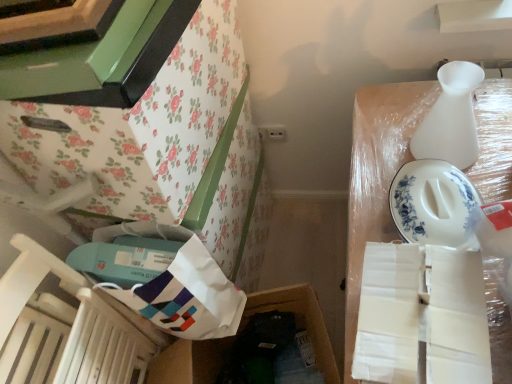
From the picture: Measure the distance between point (x=21, y=290) and camera.

The depth of point (x=21, y=290) is 32.72 inches.

Find the location of a particular element. The height and width of the screenshot is (384, 512). white paper bag at lower left, positioned as the second wrapping paper in front-to-back order is located at coordinates (187, 296).

The height and width of the screenshot is (384, 512). Find the location of `white paper bag at lower left, which is counted as the 1th storage box, starting from the left`. white paper bag at lower left, which is counted as the 1th storage box, starting from the left is located at coordinates (298, 320).

In order to click on white matte vase at upper right in this screenshot , I will do `click(451, 118)`.

Describe the element at coordinates (422, 315) in the screenshot. Image resolution: width=512 pixels, height=384 pixels. I see `white matte wrapping paper at right, the 1th wrapping paper in the right-to-left sequence` at that location.

The image size is (512, 384). I want to click on white cardboard box at upper right, which is counted as the 1th storage box, starting from the right, so click(377, 176).

At what (x,y) coordinates should I click in order to perform the action: click on wrapping paper lying on the left of white paper bag at lower left, the 2th storage box positioned from the right. Please return your answer as a coordinate pair (x, y). Looking at the image, I should click on (187, 296).

Considering the relative sizes of white paper bag at lower left, positioned as the second wrapping paper in front-to-back order, and white paper bag at lower left, the 2th storage box positioned from the right, in the image provided, is white paper bag at lower left, positioned as the second wrapping paper in front-to-back order, taller than white paper bag at lower left, the 2th storage box positioned from the right,?

In fact, white paper bag at lower left, positioned as the second wrapping paper in front-to-back order, may be shorter than white paper bag at lower left, the 2th storage box positioned from the right.

From the image's perspective, is white paper bag at lower left, the first wrapping paper positioned from the left, over white paper bag at lower left, the 2th storage box positioned from the right?

Correct, white paper bag at lower left, the first wrapping paper positioned from the left, appears higher than white paper bag at lower left, the 2th storage box positioned from the right, in the image.

Would you say floral paper-covered cabinet at upper left contains white cardboard box at upper right, which is counted as the 1th storage box, starting from the right?

That's incorrect, white cardboard box at upper right, which is counted as the 1th storage box, starting from the right, is not inside floral paper-covered cabinet at upper left.

Between floral paper-covered cabinet at upper left and white cardboard box at upper right, which is counted as the 1th storage box, starting from the right, which one is positioned in front?

white cardboard box at upper right, which is counted as the 1th storage box, starting from the right.

From a real-world perspective, is floral paper-covered cabinet at upper left positioned over white cardboard box at upper right, which is counted as the 1th storage box, starting from the right, based on gravity?

Correct, in the physical world, floral paper-covered cabinet at upper left is higher than white cardboard box at upper right, which is counted as the 1th storage box, starting from the right.

Can you confirm if floral paper-covered cabinet at upper left is taller than white cardboard box at upper right, which is counted as the 1th storage box, starting from the right?

No, floral paper-covered cabinet at upper left is not taller than white cardboard box at upper right, which is counted as the 1th storage box, starting from the right.

Is wooden chair at lower left looking in the opposite direction of white cardboard box at upper right, which is counted as the 1th storage box, starting from the right?

No, wooden chair at lower left is not facing away from white cardboard box at upper right, which is counted as the 1th storage box, starting from the right.

From a real-world perspective, which is physically above, wooden chair at lower left or white cardboard box at upper right, which is counted as the 1th storage box, starting from the right?

In real-world perspective, wooden chair at lower left is above.

What's the angular difference between wooden chair at lower left and white cardboard box at upper right, acting as the 2th storage box starting from the left,'s facing directions?

The angle between the facing direction of wooden chair at lower left and the facing direction of white cardboard box at upper right, acting as the 2th storage box starting from the left, is 93.6 degrees.

Can we say wooden chair at lower left lies outside white cardboard box at upper right, acting as the 2th storage box starting from the left?

Yes, wooden chair at lower left is not within white cardboard box at upper right, acting as the 2th storage box starting from the left.

From a real-world perspective, is floral paper-covered cabinet at upper left under white matte vase at upper right?

No, from a real-world perspective, floral paper-covered cabinet at upper left is not below white matte vase at upper right.

Considering the relative positions of floral paper-covered cabinet at upper left and white matte vase at upper right in the image provided, is floral paper-covered cabinet at upper left to the left or to the right of white matte vase at upper right?

In the image, floral paper-covered cabinet at upper left appears on the left side of white matte vase at upper right.

Is floral paper-covered cabinet at upper left directly adjacent to white matte vase at upper right?

There is a gap between floral paper-covered cabinet at upper left and white matte vase at upper right.

Is white matte wrapping paper at right, which ranks as the second wrapping paper in left-to-right order, completely or partially inside white paper bag at lower left, the first wrapping paper positioned from the left?

No, white paper bag at lower left, the first wrapping paper positioned from the left, does not contain white matte wrapping paper at right, which ranks as the second wrapping paper in left-to-right order.

Is white paper bag at lower left, positioned as the second wrapping paper in front-to-back order, bigger than white matte wrapping paper at right, marked as the first wrapping paper in a front-to-back arrangement?

Yes.

This screenshot has width=512, height=384. In order to click on wrapping paper that is on the right side of white paper bag at lower left, the first wrapping paper positioned from the left in this screenshot , I will do `click(422, 315)`.

Does white paper bag at lower left, positioned as the second wrapping paper in front-to-back order, come behind white matte wrapping paper at right, which ranks as the second wrapping paper in back-to-front order?

Yes, the depth of white paper bag at lower left, positioned as the second wrapping paper in front-to-back order, is greater than that of white matte wrapping paper at right, which ranks as the second wrapping paper in back-to-front order.

Considering the positions of point (149, 298) and point (81, 296), is point (149, 298) closer or farther from the camera than point (81, 296)?

Point (149, 298) is positioned closer to the camera compared to point (81, 296).

From the image's perspective, which object appears higher, white paper bag at lower left, positioned as the second wrapping paper in front-to-back order, or wooden chair at lower left?

From the image's view, white paper bag at lower left, positioned as the second wrapping paper in front-to-back order, is above.

Is white paper bag at lower left, which ranks as the 1th wrapping paper in back-to-front order, positioned with its back to wooden chair at lower left?

white paper bag at lower left, which ranks as the 1th wrapping paper in back-to-front order, does not have its back to wooden chair at lower left.

How different are the orientations of white paper bag at lower left, which appears as the second wrapping paper when viewed from the right, and wooden chair at lower left in degrees?

They differ by 94.9 degrees in their facing directions.

Based on the photo, considering the sizes of white cardboard box at upper right, acting as the 2th storage box starting from the left, and white matte wrapping paper at right, which ranks as the second wrapping paper in left-to-right order, in the image, is white cardboard box at upper right, acting as the 2th storage box starting from the left, wider or thinner than white matte wrapping paper at right, which ranks as the second wrapping paper in left-to-right order,?

In the image, white cardboard box at upper right, acting as the 2th storage box starting from the left, appears to be wider than white matte wrapping paper at right, which ranks as the second wrapping paper in left-to-right order.

From the image's perspective, between white cardboard box at upper right, acting as the 2th storage box starting from the left, and white matte wrapping paper at right, marked as the first wrapping paper in a front-to-back arrangement, which one is located above?

white matte wrapping paper at right, marked as the first wrapping paper in a front-to-back arrangement, appears higher in the image.

Is white cardboard box at upper right, which is counted as the 1th storage box, starting from the right, not near white matte wrapping paper at right, marked as the first wrapping paper in a front-to-back arrangement?

No, there isn't a large distance between white cardboard box at upper right, which is counted as the 1th storage box, starting from the right, and white matte wrapping paper at right, marked as the first wrapping paper in a front-to-back arrangement.

Would you say white cardboard box at upper right, acting as the 2th storage box starting from the left, is outside white matte wrapping paper at right, marked as the first wrapping paper in a front-to-back arrangement?

Yes, white cardboard box at upper right, acting as the 2th storage box starting from the left, is not within white matte wrapping paper at right, marked as the first wrapping paper in a front-to-back arrangement.

Where is `wrapping paper that is the 1st object located in front of the white paper bag at lower left, which is counted as the 1th storage box, starting from the left`? This screenshot has width=512, height=384. wrapping paper that is the 1st object located in front of the white paper bag at lower left, which is counted as the 1th storage box, starting from the left is located at coordinates (187, 296).

The image size is (512, 384). Identify the location of furniture on the left side of white cardboard box at upper right, acting as the 2th storage box starting from the left. (162, 149).

Estimate the real-world distances between objects in this image. Which object is further from white matte wrapping paper at right, marked as the first wrapping paper in a front-to-back arrangement, white paper bag at lower left, positioned as the second wrapping paper in front-to-back order, or wooden chair at lower left?

wooden chair at lower left lies further to white matte wrapping paper at right, marked as the first wrapping paper in a front-to-back arrangement, than the other object.

Which object lies further to the anchor point white paper bag at lower left, which appears as the second wrapping paper when viewed from the right, wooden chair at lower left or white matte vase at upper right?

A: white matte vase at upper right is positioned further to the anchor white paper bag at lower left, which appears as the second wrapping paper when viewed from the right.

Considering their positions, is floral paper-covered cabinet at upper left positioned further to white cardboard box at upper right, acting as the 2th storage box starting from the left, than white matte vase at upper right?

The object further to white cardboard box at upper right, acting as the 2th storage box starting from the left, is floral paper-covered cabinet at upper left.

Based on their spatial positions, is floral paper-covered cabinet at upper left or white paper bag at lower left, the 2th storage box positioned from the right, closer to white cardboard box at upper right, acting as the 2th storage box starting from the left?

white paper bag at lower left, the 2th storage box positioned from the right, is closer to white cardboard box at upper right, acting as the 2th storage box starting from the left.

When comparing their distances from white paper bag at lower left, which is counted as the 1th storage box, starting from the left, does white matte vase at upper right or white matte wrapping paper at right, the 1th wrapping paper in the right-to-left sequence, seem closer?

Among the two, white matte wrapping paper at right, the 1th wrapping paper in the right-to-left sequence, is located nearer to white paper bag at lower left, which is counted as the 1th storage box, starting from the left.

Which object lies nearer to the anchor point wooden chair at lower left, floral paper-covered cabinet at upper left or white cardboard box at upper right, acting as the 2th storage box starting from the left?

Among the two, floral paper-covered cabinet at upper left is located nearer to wooden chair at lower left.

Looking at the image, which one is located closer to white matte vase at upper right, white matte wrapping paper at right, which ranks as the second wrapping paper in back-to-front order, or white paper bag at lower left, the 2th storage box positioned from the right?

white matte wrapping paper at right, which ranks as the second wrapping paper in back-to-front order, is closer to white matte vase at upper right.

Considering their positions, is white paper bag at lower left, which ranks as the 1th wrapping paper in back-to-front order, positioned further to white matte vase at upper right than floral paper-covered cabinet at upper left?

white paper bag at lower left, which ranks as the 1th wrapping paper in back-to-front order.

Image resolution: width=512 pixels, height=384 pixels. In order to click on storage box between wooden chair at lower left and white cardboard box at upper right, which is counted as the 1th storage box, starting from the right, in the horizontal direction in this screenshot , I will do `click(298, 320)`.

Locate an element on the screen. The height and width of the screenshot is (384, 512). vase located between wooden chair at lower left and white cardboard box at upper right, which is counted as the 1th storage box, starting from the right, in the left-right direction is located at coordinates (451, 118).

Identify the location of wrapping paper situated between wooden chair at lower left and white matte wrapping paper at right, marked as the first wrapping paper in a front-to-back arrangement, from left to right. The image size is (512, 384). (187, 296).

Where is `wrapping paper between white paper bag at lower left, which ranks as the 1th wrapping paper in back-to-front order, and white matte vase at upper right`? wrapping paper between white paper bag at lower left, which ranks as the 1th wrapping paper in back-to-front order, and white matte vase at upper right is located at coordinates (422, 315).